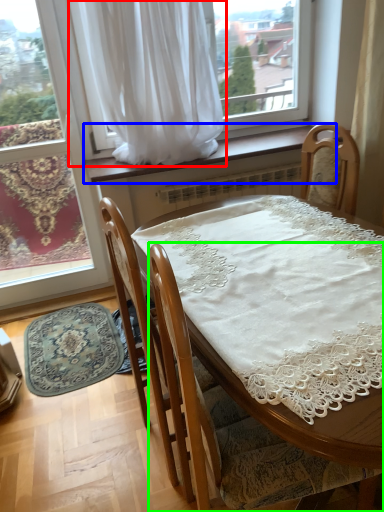
Question: Based on their relative distances, which object is nearer to curtain (highlighted by a red box)? Choose from window sill (highlighted by a blue box) and chair (highlighted by a green box).

Choices:
 (A) window sill
 (B) chair

Answer: (A)